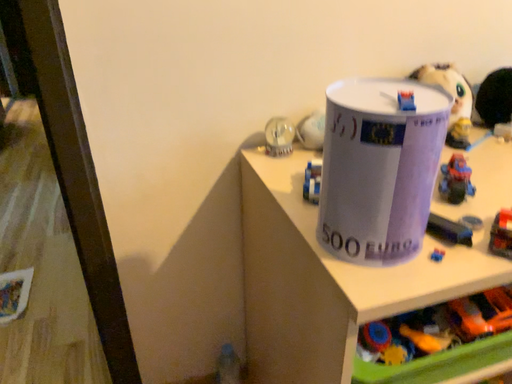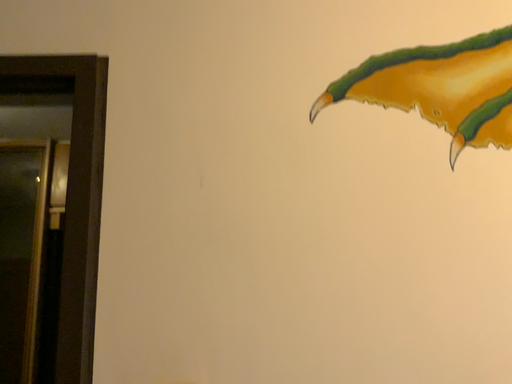
Question: Which way did the camera rotate in the video?

Choices:
 (A) rotated downward
 (B) rotated upward

Answer: (B)